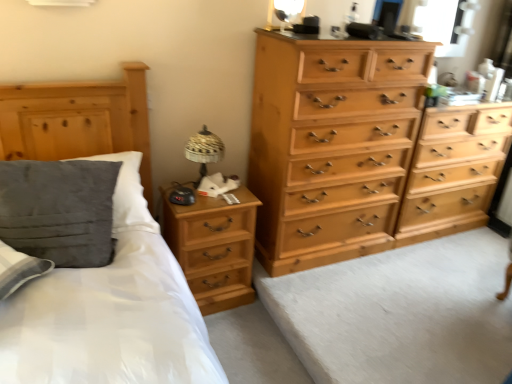
What is the approximate width of matte gold table lamp at upper center, the second table lamp in the bottom-to-top sequence?

The width of matte gold table lamp at upper center, the second table lamp in the bottom-to-top sequence, is 2.23 inches.

Locate an element on the screen. light wood chest of drawers at right, the 1th chest of drawers when ordered from left to right is located at coordinates (360, 152).

How much space does woven fabric table lamp at upper right, placed as the second table lamp when sorted from right to left, occupy horizontally?

The width of woven fabric table lamp at upper right, placed as the second table lamp when sorted from right to left, is 16.64 centimeters.

The image size is (512, 384). Find the location of `velvety gray pillow at left`. velvety gray pillow at left is located at coordinates (59, 210).

Identify the location of matte gold table lamp at upper center, which is the 1th table lamp from top to bottom. (288, 10).

Where is `plain lying on the right of light brown wood nightstand at lower left`? This screenshot has height=384, width=512. plain lying on the right of light brown wood nightstand at lower left is located at coordinates (400, 313).

From the image's perspective, is light brown wood nightstand at lower left positioned above or below light brown wood dresser at center?

Based on their image positions, light brown wood nightstand at lower left is located above light brown wood dresser at center.

Is light brown wood nightstand at lower left at the left side of light brown wood dresser at center?

Correct, you'll find light brown wood nightstand at lower left to the left of light brown wood dresser at center.

Considering the positions of objects light brown wood nightstand at lower left and light brown wood dresser at center in the image provided, who is behind, light brown wood nightstand at lower left or light brown wood dresser at center?

light brown wood nightstand at lower left is further away from the camera.

Considering the relative sizes of transparent glass window at upper right and light wood chest of drawers at right, the 2th chest of drawers in the right-to-left sequence, in the image provided, is transparent glass window at upper right smaller than light wood chest of drawers at right, the 2th chest of drawers in the right-to-left sequence,?

Yes.

Is transparent glass window at upper right to the right of light wood chest of drawers at right, the 2th chest of drawers in the right-to-left sequence, from the viewer's perspective?

Indeed, transparent glass window at upper right is positioned on the right side of light wood chest of drawers at right, the 2th chest of drawers in the right-to-left sequence.

Is point (439, 48) positioned in front of point (328, 83)?

No, (439, 48) is further to viewer.

Considering the sizes of objects transparent glass window at upper right and light wood chest of drawers at right, the 2th chest of drawers in the right-to-left sequence, in the image provided, who is taller, transparent glass window at upper right or light wood chest of drawers at right, the 2th chest of drawers in the right-to-left sequence,?

light wood chest of drawers at right, the 2th chest of drawers in the right-to-left sequence, is taller.

Considering the positions of objects woven fabric table lamp at upper right, the second table lamp positioned from the top, and light wood chest of drawers at right, the 2th chest of drawers in the right-to-left sequence, in the image provided, who is more to the left, woven fabric table lamp at upper right, the second table lamp positioned from the top, or light wood chest of drawers at right, the 2th chest of drawers in the right-to-left sequence,?

Positioned to the left is woven fabric table lamp at upper right, the second table lamp positioned from the top.

How far apart are woven fabric table lamp at upper right, the second table lamp positioned from the top, and light wood chest of drawers at right, the 2th chest of drawers in the right-to-left sequence?

woven fabric table lamp at upper right, the second table lamp positioned from the top, and light wood chest of drawers at right, the 2th chest of drawers in the right-to-left sequence, are 83.58 centimeters apart from each other.

Is point (190, 138) behind point (392, 189)?

No, (190, 138) is in front of (392, 189).

Is the position of woven fabric table lamp at upper right, placed as the second table lamp when sorted from right to left, more distant than that of light wood chest of drawers at right, the 2th chest of drawers in the right-to-left sequence?

Yes, woven fabric table lamp at upper right, placed as the second table lamp when sorted from right to left, is further from the viewer.

What's the angular difference between suede-like gray pillow at left and light wood chest of drawers at center right, marked as the 1th chest of drawers in a right-to-left arrangement,'s facing directions?

They differ by 2.22 degrees in their facing directions.

Considering the relative sizes of suede-like gray pillow at left and light wood chest of drawers at center right, marked as the 1th chest of drawers in a right-to-left arrangement, in the image provided, is suede-like gray pillow at left shorter than light wood chest of drawers at center right, marked as the 1th chest of drawers in a right-to-left arrangement,?

Yes, suede-like gray pillow at left is shorter than light wood chest of drawers at center right, marked as the 1th chest of drawers in a right-to-left arrangement.

Looking at this image, is suede-like gray pillow at left next to light wood chest of drawers at center right, marked as the 1th chest of drawers in a right-to-left arrangement?

suede-like gray pillow at left and light wood chest of drawers at center right, marked as the 1th chest of drawers in a right-to-left arrangement, are not in contact.

In terms of size, does suede-like gray pillow at left appear bigger or smaller than light wood chest of drawers at center right, marked as the 1th chest of drawers in a right-to-left arrangement?

Clearly, suede-like gray pillow at left is smaller in size than light wood chest of drawers at center right, marked as the 1th chest of drawers in a right-to-left arrangement.

How far apart are velvety gray pillow at left and matte gold table lamp at upper center, marked as the first table lamp in a right-to-left arrangement?

velvety gray pillow at left is 4.65 feet away from matte gold table lamp at upper center, marked as the first table lamp in a right-to-left arrangement.

Is velvety gray pillow at left completely or partially outside of matte gold table lamp at upper center, which is the 1th table lamp from top to bottom?

Yes.

In the scene shown: Does velvety gray pillow at left have a lesser width compared to matte gold table lamp at upper center, the second table lamp when ordered from left to right?

No.

From a real-world perspective, which is physically above, velvety gray pillow at left or matte gold table lamp at upper center, the second table lamp in the bottom-to-top sequence?

matte gold table lamp at upper center, the second table lamp in the bottom-to-top sequence.

In the image, there is a light wood chest of drawers at center right, marked as the 1th chest of drawers in a right-to-left arrangement. In order to click on nightstand below it (from a real-world perspective) in this screenshot , I will do `click(214, 247)`.

Is the surface of light wood chest of drawers at center right, marked as the 1th chest of drawers in a right-to-left arrangement, in direct contact with light brown wood nightstand at lower left?

light wood chest of drawers at center right, marked as the 1th chest of drawers in a right-to-left arrangement, is not next to light brown wood nightstand at lower left, and they're not touching.

In the scene shown: Considering the sizes of objects light wood chest of drawers at center right, marked as the 1th chest of drawers in a right-to-left arrangement, and light brown wood nightstand at lower left in the image provided, who is thinner, light wood chest of drawers at center right, marked as the 1th chest of drawers in a right-to-left arrangement, or light brown wood nightstand at lower left?

light brown wood nightstand at lower left is thinner.

From a real-world perspective, between light wood chest of drawers at center right, positioned as the second chest of drawers in left-to-right order, and light brown wood nightstand at lower left, who is vertically lower?

light brown wood nightstand at lower left is physically lower.

Is light wood chest of drawers at right, the 1th chest of drawers when ordered from left to right, next to light wood chest of drawers at center right, positioned as the second chest of drawers in left-to-right order, and touching it?

light wood chest of drawers at right, the 1th chest of drawers when ordered from left to right, and light wood chest of drawers at center right, positioned as the second chest of drawers in left-to-right order, are clearly separated.

From a real-world perspective, is light wood chest of drawers at right, the 2th chest of drawers in the right-to-left sequence, located beneath light wood chest of drawers at center right, positioned as the second chest of drawers in left-to-right order?

No, from a real-world perspective, light wood chest of drawers at right, the 2th chest of drawers in the right-to-left sequence, is not below light wood chest of drawers at center right, positioned as the second chest of drawers in left-to-right order.

Is light wood chest of drawers at right, the 1th chest of drawers when ordered from left to right, completely or partially outside of light wood chest of drawers at center right, marked as the 1th chest of drawers in a right-to-left arrangement?

Indeed, light wood chest of drawers at right, the 1th chest of drawers when ordered from left to right, is completely outside light wood chest of drawers at center right, marked as the 1th chest of drawers in a right-to-left arrangement.

Locate an element on the screen. This screenshot has width=512, height=384. chest of drawers located on the left of light wood chest of drawers at center right, marked as the 1th chest of drawers in a right-to-left arrangement is located at coordinates (360, 152).

Identify the location of nightstand above the light brown wood dresser at center (from the image's perspective). (214, 247).

Where is `window above the light wood chest of drawers at right, the 2th chest of drawers in the right-to-left sequence (from a real-world perspective)`? window above the light wood chest of drawers at right, the 2th chest of drawers in the right-to-left sequence (from a real-world perspective) is located at coordinates (442, 24).

Which object lies nearer to the anchor point matte gold table lamp at upper center, the second table lamp in the bottom-to-top sequence, light wood chest of drawers at center right, marked as the 1th chest of drawers in a right-to-left arrangement, or light wood chest of drawers at right, the 1th chest of drawers when ordered from left to right?

light wood chest of drawers at right, the 1th chest of drawers when ordered from left to right, is closer to matte gold table lamp at upper center, the second table lamp in the bottom-to-top sequence.

Which object lies further to the anchor point matte gold table lamp at upper center, the second table lamp in the bottom-to-top sequence, light brown wood nightstand at lower left or transparent glass window at upper right?

transparent glass window at upper right.

Estimate the real-world distances between objects in this image. Which object is further from light brown wood dresser at center, velvety gray pillow at left or matte gold table lamp at upper center, which is the 1th table lamp from top to bottom?

The object further to light brown wood dresser at center is matte gold table lamp at upper center, which is the 1th table lamp from top to bottom.

Estimate the real-world distances between objects in this image. Which object is further from matte gold table lamp at upper center, marked as the first table lamp in a right-to-left arrangement, woven fabric table lamp at upper right, the second table lamp positioned from the top, or light wood chest of drawers at right, the 2th chest of drawers in the right-to-left sequence?

The object further to matte gold table lamp at upper center, marked as the first table lamp in a right-to-left arrangement, is light wood chest of drawers at right, the 2th chest of drawers in the right-to-left sequence.

Which object lies further to the anchor point suede-like gray pillow at left, matte gold table lamp at upper center, which is the 1th table lamp from top to bottom, or velvety gray pillow at left?

matte gold table lamp at upper center, which is the 1th table lamp from top to bottom, is further to suede-like gray pillow at left.

When comparing their distances from light wood chest of drawers at right, the 1th chest of drawers when ordered from left to right, does light brown wood nightstand at lower left or woven fabric table lamp at upper right, the second table lamp positioned from the top, seem closer?

light brown wood nightstand at lower left.

Looking at the image, which one is located further to light wood chest of drawers at center right, positioned as the second chest of drawers in left-to-right order, light brown wood nightstand at lower left or suede-like gray pillow at left?

suede-like gray pillow at left is further to light wood chest of drawers at center right, positioned as the second chest of drawers in left-to-right order.

Looking at the image, which one is located further to light wood chest of drawers at center right, positioned as the second chest of drawers in left-to-right order, matte gold table lamp at upper center, which is the 1th table lamp from top to bottom, or light wood chest of drawers at right, the 2th chest of drawers in the right-to-left sequence?

Based on the image, matte gold table lamp at upper center, which is the 1th table lamp from top to bottom, appears to be further to light wood chest of drawers at center right, positioned as the second chest of drawers in left-to-right order.

Where is `chest of drawers between light wood chest of drawers at right, the 1th chest of drawers when ordered from left to right, and light brown wood dresser at center from top to bottom`? The height and width of the screenshot is (384, 512). chest of drawers between light wood chest of drawers at right, the 1th chest of drawers when ordered from left to right, and light brown wood dresser at center from top to bottom is located at coordinates (454, 170).

The width and height of the screenshot is (512, 384). I want to click on plain located between velvety gray pillow at left and light wood chest of drawers at center right, marked as the 1th chest of drawers in a right-to-left arrangement, in the left-right direction, so click(400, 313).

This screenshot has width=512, height=384. What are the coordinates of `bed between velvety gray pillow at left and transparent glass window at upper right` in the screenshot? It's located at (101, 268).

Where is `nightstand between suede-like gray pillow at left and light brown wood dresser at center in the horizontal direction`? The image size is (512, 384). nightstand between suede-like gray pillow at left and light brown wood dresser at center in the horizontal direction is located at coordinates (214, 247).